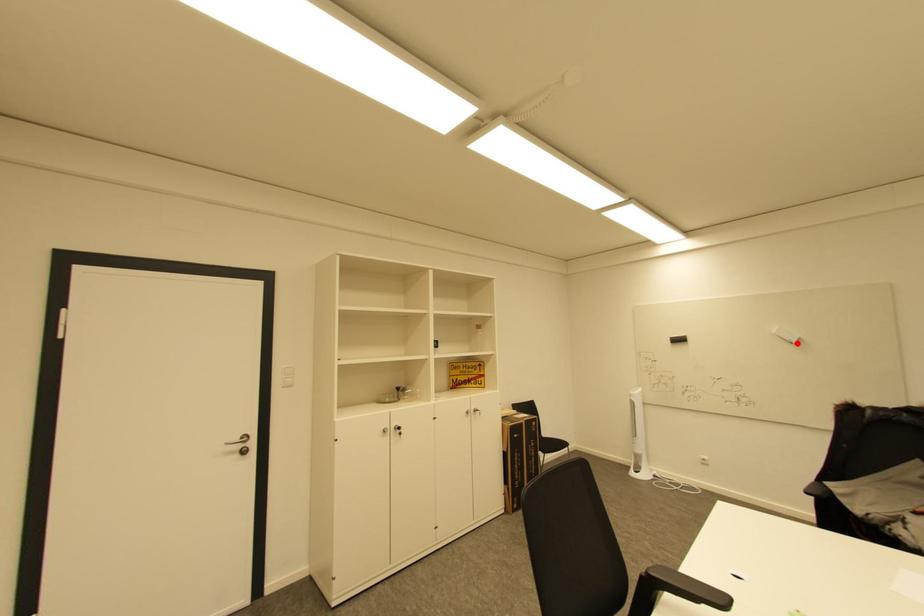
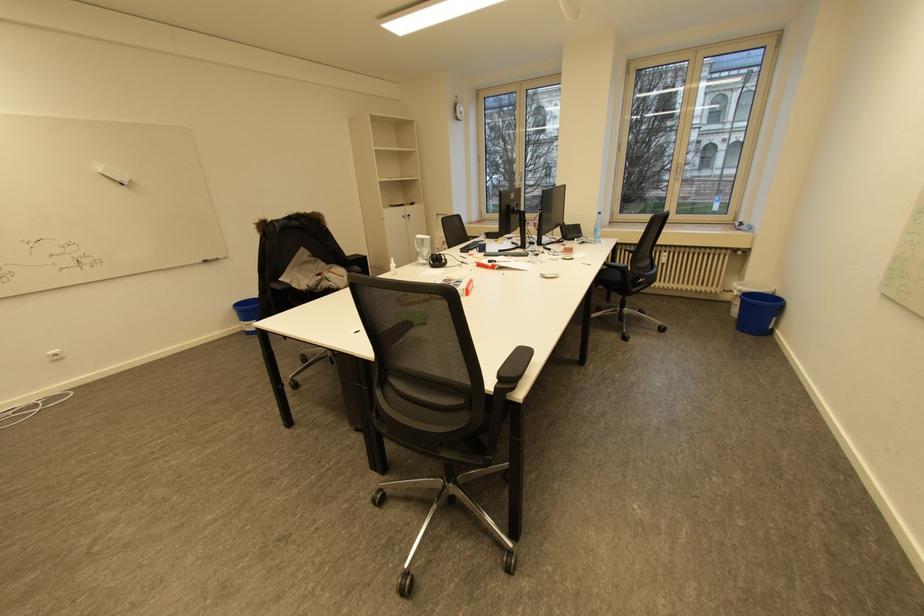
Locate, in the second image, the point that corresponds to the highlighted location in the first image.

(128, 185)